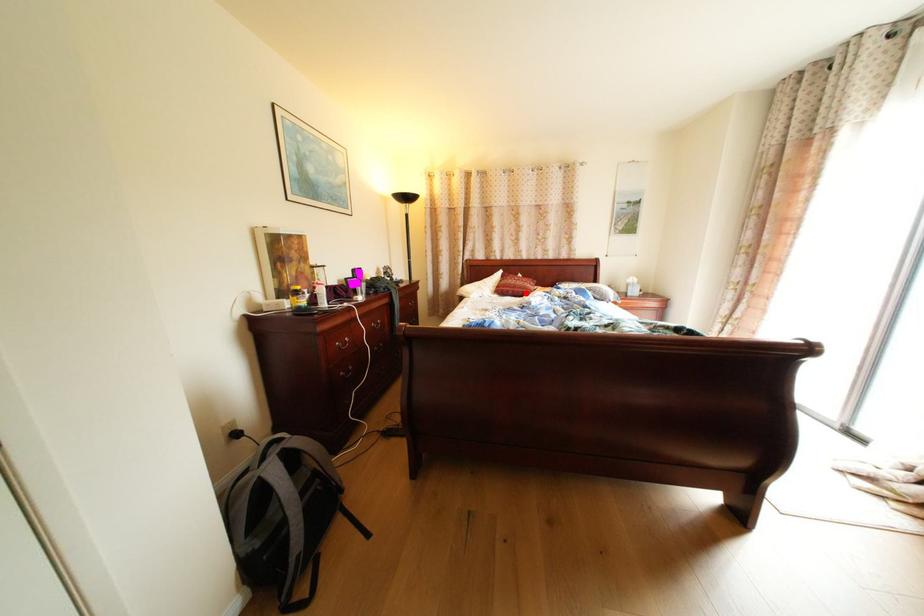
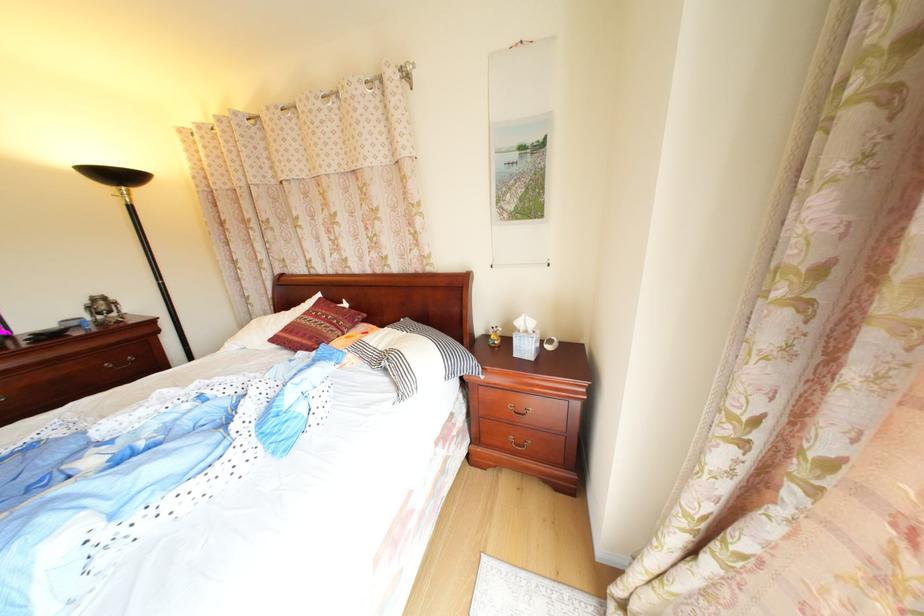
The point at the highlighted location is marked in the first image. Where is the corresponding point in the second image?

(304, 342)